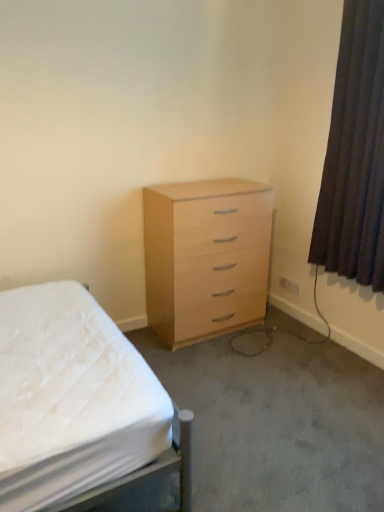
What do you see at coordinates (355, 154) in the screenshot? I see `dark brown fabric curtain at right` at bounding box center [355, 154].

At what (x,y) coordinates should I click in order to perform the action: click on white fabric bed at center. Please return your answer as a coordinate pair (x, y). Image resolution: width=384 pixels, height=512 pixels. Looking at the image, I should click on (83, 411).

Find the location of a particular element. dark brown fabric curtain at right is located at coordinates (355, 154).

From a real-world perspective, is white fabric bed at center under dark brown fabric curtain at right?

Yes, from a real-world perspective, white fabric bed at center is beneath dark brown fabric curtain at right.

Looking at the image, does white fabric bed at center seem bigger or smaller compared to dark brown fabric curtain at right?

In the image, white fabric bed at center appears to be larger than dark brown fabric curtain at right.

Would you say white fabric bed at center is outside dark brown fabric curtain at right?

Yes, white fabric bed at center is outside of dark brown fabric curtain at right.

How different are the orientations of white fabric bed at center and dark brown fabric curtain at right in degrees?

The angular difference between white fabric bed at center and dark brown fabric curtain at right is 180 degrees.

Which of these two, light wood/veneer chest of drawers at center or dark brown fabric curtain at right, stands shorter?

With less height is light wood/veneer chest of drawers at center.

Considering the positions of objects light wood/veneer chest of drawers at center and dark brown fabric curtain at right in the image provided, who is more to the right, light wood/veneer chest of drawers at center or dark brown fabric curtain at right?

From the viewer's perspective, dark brown fabric curtain at right appears more on the right side.

From the image's perspective, does light wood/veneer chest of drawers at center appear higher than dark brown fabric curtain at right?

No, from the image's perspective, light wood/veneer chest of drawers at center is not above dark brown fabric curtain at right.

Does light wood/veneer chest of drawers at center have a lesser width compared to dark brown fabric curtain at right?

Incorrect, the width of light wood/veneer chest of drawers at center is not less than that of dark brown fabric curtain at right.

Are light wood/veneer chest of drawers at center and white fabric bed at center making contact?

No, light wood/veneer chest of drawers at center is not making contact with white fabric bed at center.

Considering the sizes of light wood/veneer chest of drawers at center and white fabric bed at center in the image, is light wood/veneer chest of drawers at center wider or thinner than white fabric bed at center?

light wood/veneer chest of drawers at center is thinner than white fabric bed at center.

Based on their sizes in the image, would you say light wood/veneer chest of drawers at center is bigger or smaller than white fabric bed at center?

Clearly, light wood/veneer chest of drawers at center is smaller in size than white fabric bed at center.

From a real-world perspective, is light wood/veneer chest of drawers at center positioned under white fabric bed at center based on gravity?

No, from a real-world perspective, light wood/veneer chest of drawers at center is not below white fabric bed at center.

In the image, is dark brown fabric curtain at right on the left side or the right side of white fabric bed at center?

Based on their positions, dark brown fabric curtain at right is located to the right of white fabric bed at center.

In the scene shown: Which of these two, dark brown fabric curtain at right or white fabric bed at center, is wider?

white fabric bed at center is wider.

Would you say dark brown fabric curtain at right contains white fabric bed at center?

That's incorrect, white fabric bed at center is not inside dark brown fabric curtain at right.

In the scene shown: How many degrees apart are the facing directions of dark brown fabric curtain at right and white fabric bed at center?

There is a 180-degree angle between the facing directions of dark brown fabric curtain at right and white fabric bed at center.

From the image's perspective, would you say white fabric bed at center is shown under light wood/veneer chest of drawers at center?

Yes.

Would you say white fabric bed at center is outside light wood/veneer chest of drawers at center?

Absolutely, white fabric bed at center is external to light wood/veneer chest of drawers at center.

From a real-world perspective, between white fabric bed at center and light wood/veneer chest of drawers at center, who is vertically higher?

light wood/veneer chest of drawers at center is physically above.

Between white fabric bed at center and light wood/veneer chest of drawers at center, which one has less height?

white fabric bed at center is shorter.

From the picture: Does dark brown fabric curtain at right have a lesser width compared to light wood/veneer chest of drawers at center?

Yes.

Considering the points (377, 41) and (156, 232), which point is behind, point (377, 41) or point (156, 232)?

Point (156, 232)

Is dark brown fabric curtain at right at the left side of light wood/veneer chest of drawers at center?

No, dark brown fabric curtain at right is not to the left of light wood/veneer chest of drawers at center.

Locate an element on the screen. curtain on the right of white fabric bed at center is located at coordinates (355, 154).

Find the location of a particular element. The height and width of the screenshot is (512, 384). chest of drawers below the dark brown fabric curtain at right (from a real-world perspective) is located at coordinates (206, 256).

Considering their positions, is white fabric bed at center positioned closer to light wood/veneer chest of drawers at center than dark brown fabric curtain at right?

dark brown fabric curtain at right.

Based on their spatial positions, is dark brown fabric curtain at right or white fabric bed at center further from light wood/veneer chest of drawers at center?

white fabric bed at center lies further to light wood/veneer chest of drawers at center than the other object.

From the image, which object appears to be nearer to dark brown fabric curtain at right, light wood/veneer chest of drawers at center or white fabric bed at center?

light wood/veneer chest of drawers at center.

Estimate the real-world distances between objects in this image. Which object is further from white fabric bed at center, dark brown fabric curtain at right or light wood/veneer chest of drawers at center?

dark brown fabric curtain at right is positioned further to the anchor white fabric bed at center.

Based on their spatial positions, is white fabric bed at center or light wood/veneer chest of drawers at center further from dark brown fabric curtain at right?

white fabric bed at center is positioned further to the anchor dark brown fabric curtain at right.

Looking at the image, which one is located further to white fabric bed at center, light wood/veneer chest of drawers at center or dark brown fabric curtain at right?

dark brown fabric curtain at right.

You are a GUI agent. You are given a task and a screenshot of the screen. Output one action in this format:
    pyautogui.click(x=<x>, y=<y>)
    Task: Click on the chest of drawers between white fabric bed at center and dark brown fabric curtain at right from left to right
    
    Given the screenshot: What is the action you would take?
    pyautogui.click(x=206, y=256)